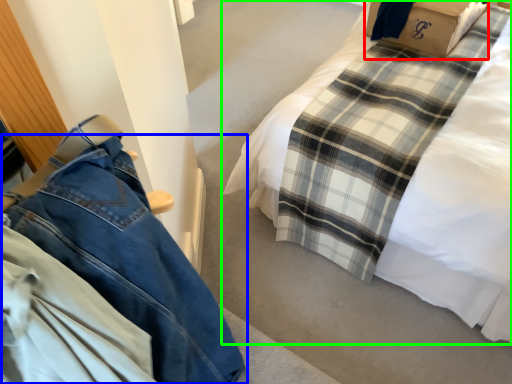
Question: Which object is positioned closest to cardboard box (highlighted by a red box)? Select from trousers (highlighted by a blue box) and bed (highlighted by a green box).

Choices:
 (A) trousers
 (B) bed

Answer: (B)